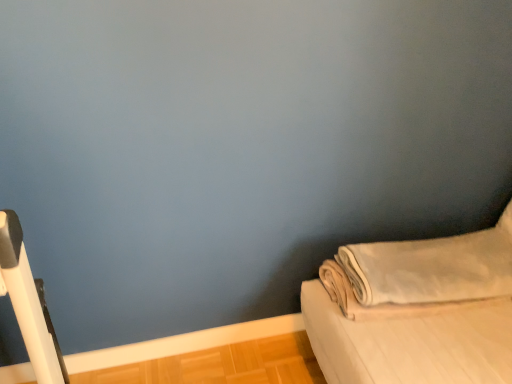
The image size is (512, 384). What do you see at coordinates (415, 310) in the screenshot?
I see `beige fabric bed at lower right` at bounding box center [415, 310].

Locate an element on the screen. The height and width of the screenshot is (384, 512). beige fabric bed at lower right is located at coordinates (415, 310).

Find the location of a particular element. beige fabric bed at lower right is located at coordinates (415, 310).